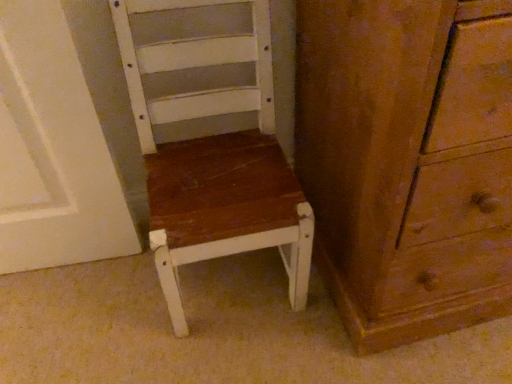
At what (x,y) coordinates should I click in order to perform the action: click on white wood chair at center. Please return your answer as a coordinate pair (x, y). Looking at the image, I should click on (214, 156).

What is the approximate height of white wood chair at center?

white wood chair at center is 25.56 inches in height.

What do you see at coordinates (214, 156) in the screenshot? I see `white wood chair at center` at bounding box center [214, 156].

Where is `white wood chair at center`? Image resolution: width=512 pixels, height=384 pixels. white wood chair at center is located at coordinates (214, 156).